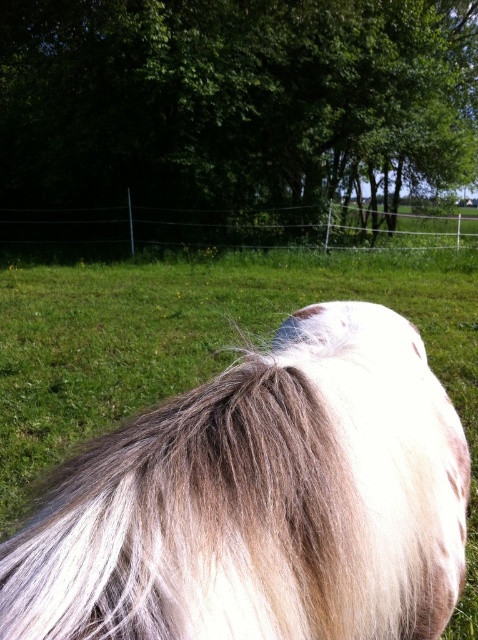
Can you confirm if white silky mane at center is bigger than black wire fence at upper center?

No, white silky mane at center is not bigger than black wire fence at upper center.

Can you confirm if white silky mane at center is wider than black wire fence at upper center?

No, white silky mane at center is not wider than black wire fence at upper center.

This screenshot has height=640, width=478. Identify the location of white silky mane at center. (260, 500).

Locate an element on the screen. white silky mane at center is located at coordinates (260, 500).

Who is shorter, green leafy tree at upper center or black wire fence at upper center?

black wire fence at upper center

Is green leafy tree at upper center below black wire fence at upper center?

Actually, green leafy tree at upper center is above black wire fence at upper center.

Between point (217, 12) and point (18, 218), which one is positioned behind?

The point (18, 218) is behind.

The width and height of the screenshot is (478, 640). I want to click on green leafy tree at upper center, so click(x=232, y=118).

Is white silky mane at center below green leafy tree at upper center?

Yes, white silky mane at center is below green leafy tree at upper center.

Does white silky mane at center lie behind green leafy tree at upper center?

No, white silky mane at center is in front of green leafy tree at upper center.

Which is in front, point (275, 344) or point (215, 208)?

Point (275, 344) is in front.

Identify the location of white silky mane at center. (260, 500).